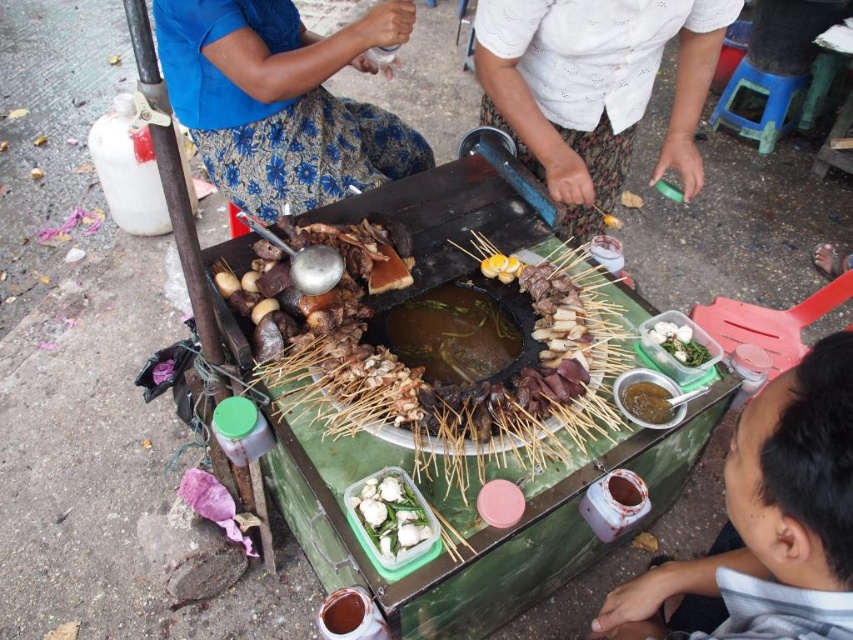
Which is more to the right, white glossy shell at center or shiny brown sauce at center?

shiny brown sauce at center

Is white glossy shell at center wider than shiny brown sauce at center?

Correct, the width of white glossy shell at center exceeds that of shiny brown sauce at center.

What do you see at coordinates (392, 515) in the screenshot? I see `white glossy shell at center` at bounding box center [392, 515].

What are the coordinates of `white glossy shell at center` in the screenshot? It's located at (392, 515).

Can you confirm if gray cotton shirt at lower right is wider than white glossy shell at center?

Indeed, gray cotton shirt at lower right has a greater width compared to white glossy shell at center.

Between gray cotton shirt at lower right and white glossy shell at center, which one appears on the left side from the viewer's perspective?

white glossy shell at center is more to the left.

Locate an element on the screen. gray cotton shirt at lower right is located at coordinates (769, 520).

You are a GUI agent. You are given a task and a screenshot of the screen. Output one action in this format:
    pyautogui.click(x=<x>, y=<y>)
    Task: Click on the gray cotton shirt at lower right
    
    Given the screenshot: What is the action you would take?
    pyautogui.click(x=769, y=520)

Who is lower down, gray cotton shirt at lower right or shiny brown sauce at center?

gray cotton shirt at lower right is below.

Is gray cotton shirt at lower right bigger than shiny brown sauce at center?

Yes.

Who is more forward, (x=721, y=634) or (x=650, y=388)?

Positioned in front is point (x=721, y=634).

Locate an element on the screen. This screenshot has height=640, width=853. gray cotton shirt at lower right is located at coordinates (769, 520).